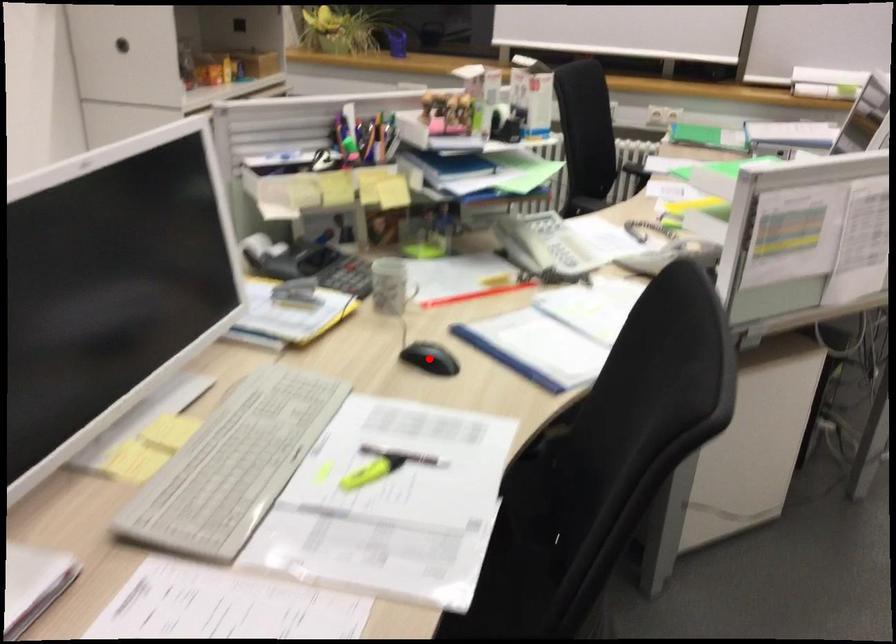
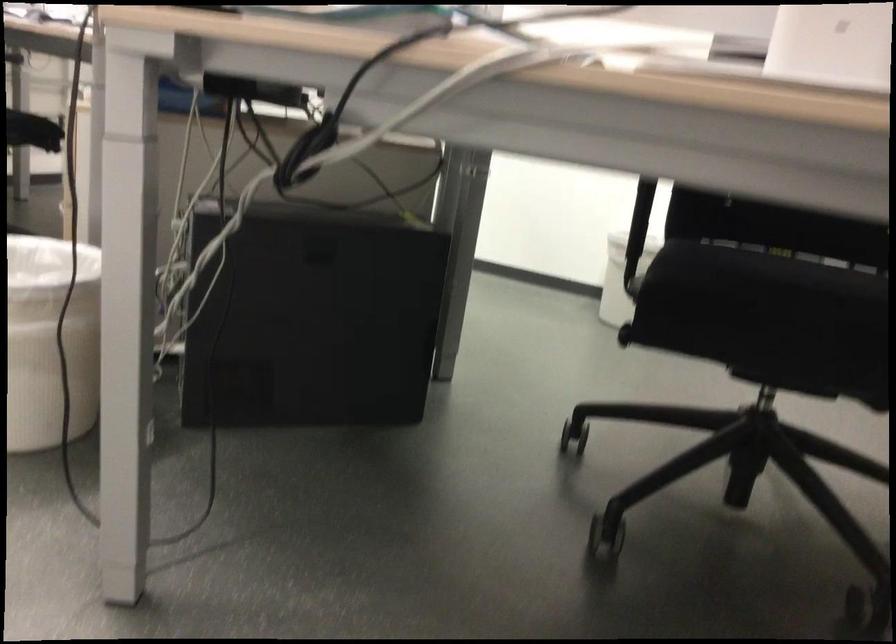
Question: I am providing you with two images of the same scene from different viewpoints. A red point is marked on the first image. Is the red point's position out of view in image 2?

Choices:
 (A) Yes
 (B) No

Answer: (A)